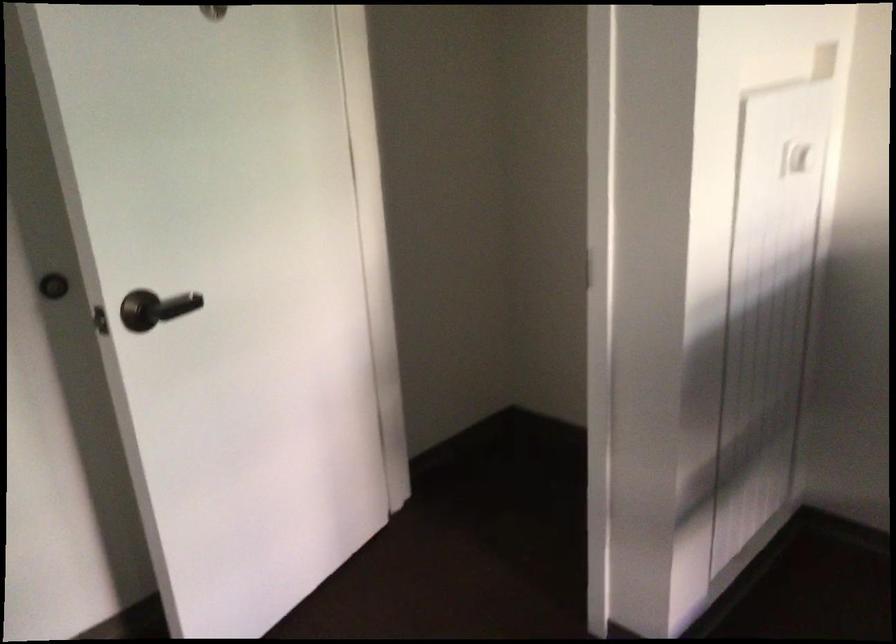
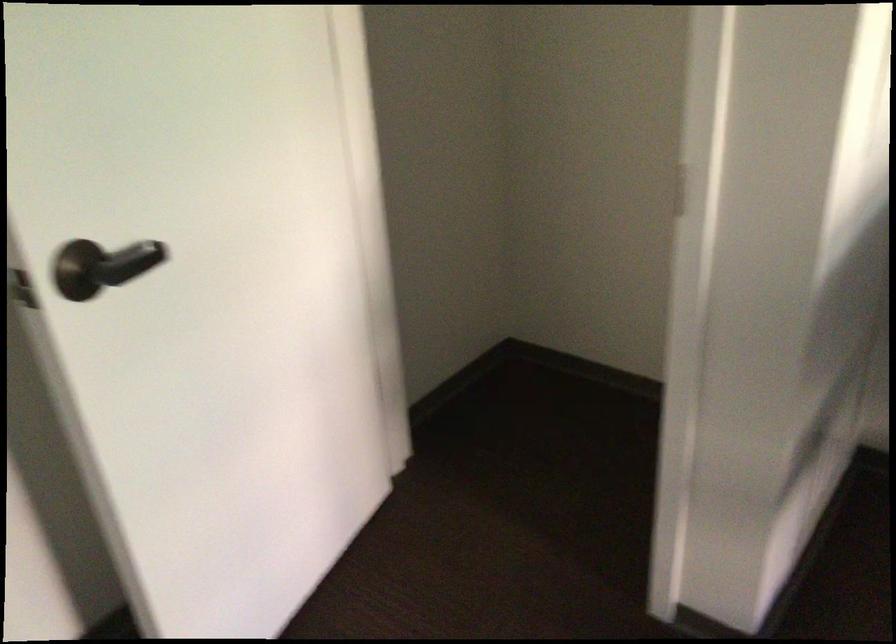
Question: Based on the continuous images, in which direction is the camera rotating? Reply with the corresponding letter.

Choices:
 (A) Left
 (B) Right
 (C) Up
 (D) Down

Answer: (D)